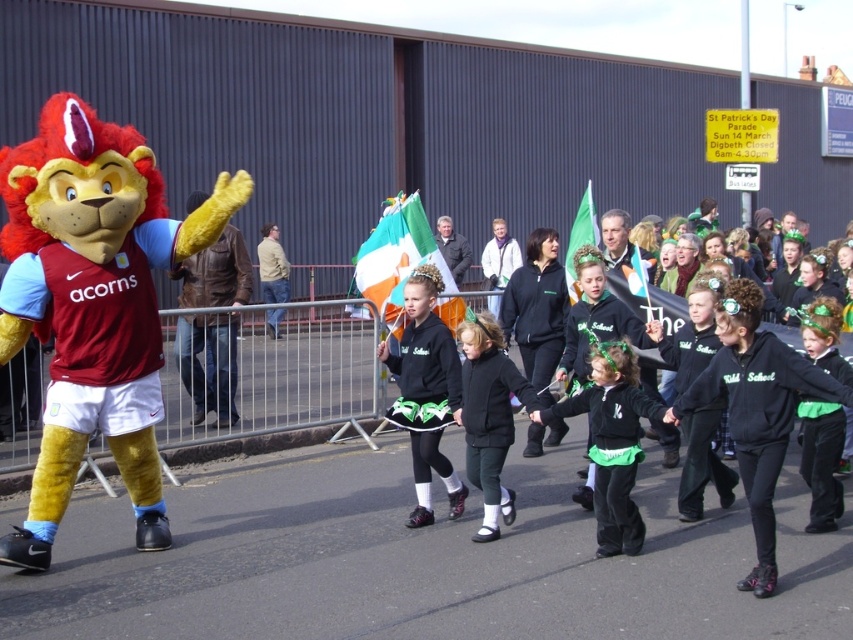
Question: Can you confirm if velvet plush lion at left is wider than irish flag at center?

Choices:
 (A) no
 (B) yes

Answer: (B)

Question: Which object appears closest to the camera in this image?

Choices:
 (A) black fleece at center
 (B) velvet plush lion at left
 (C) black fabric dress at center

Answer: (A)

Question: In this image, where is black fleece at center located relative to green fabric flag at center?

Choices:
 (A) below
 (B) above

Answer: (A)

Question: Which point is farther to the camera?

Choices:
 (A) (421, 272)
 (B) (825, 372)
 (C) (143, 307)
 (D) (755, 484)

Answer: (A)

Question: Which object is the closest to the black fabric dress at center?

Choices:
 (A) black matte jackets at center
 (B) black fleece at center
 (C) velvet black jacket at center

Answer: (B)

Question: Can you confirm if black matte jackets at center is positioned to the left of black matte jacket at center?

Choices:
 (A) yes
 (B) no

Answer: (B)